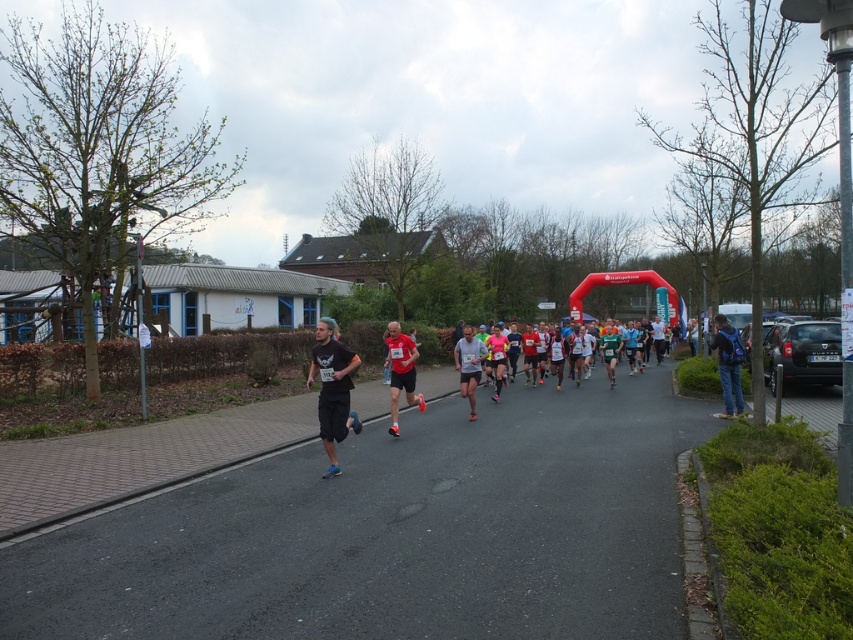
You are a photographer at the marathon event. You want to capture a photo of the black matte shorts at center and the red running shoe at center in the same frame. Which object should you focus on first to ensure both are in focus?

The black matte shorts at center is much taller than the red running shoe at center, so you should focus on the black matte shorts at center first to ensure both are in focus.

You are a photographer at the marathon event and want to capture a closeup shot of the black matte shorts at center and the gray fabric shirt at center. Which one would appear bigger in your photo?

The black matte shorts at center would appear bigger in the photo because it is larger in size than the gray fabric shirt at center.

You are a photographer standing at the starting line of the marathon. You want to take a photo that includes both the point at coordinates point(328,358) and point(409,397). Which point will appear larger in the photo?

Point(328,358) is closer to the camera than point(409,397), so it will appear larger in the photo.